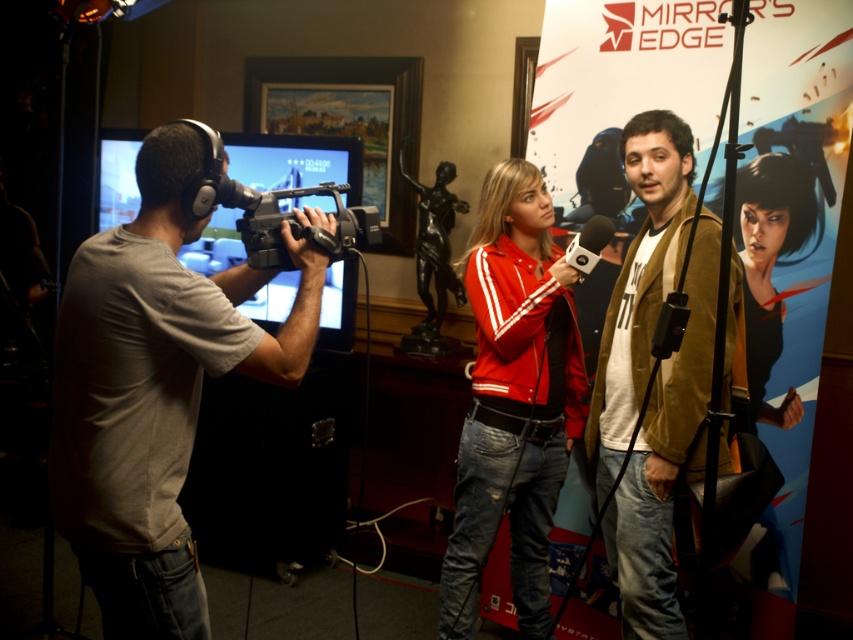
Question: Is brown textured jacket at center positioned in front of black matte video camera at center?

Choices:
 (A) no
 (B) yes

Answer: (A)

Question: Which of the following is the closest to the observer?

Choices:
 (A) black matte microphone at center
 (B) black matte video camera at center
 (C) blue glossy poster at center right
 (D) matte red jacket at center

Answer: (B)

Question: Estimate the real-world distances between objects in this image. Which object is closer to the matte red jacket at center?

Choices:
 (A) black matte video camera at center
 (B) gray fabric shirt at left

Answer: (A)

Question: Does matte red jacket at center have a greater width compared to black matte microphone at center?

Choices:
 (A) no
 (B) yes

Answer: (B)

Question: Which point is farther to the camera?

Choices:
 (A) tap(543, 397)
 (B) tap(598, 237)

Answer: (A)

Question: Can you confirm if blue glossy poster at center right is bigger than brown textured jacket at center?

Choices:
 (A) no
 (B) yes

Answer: (B)